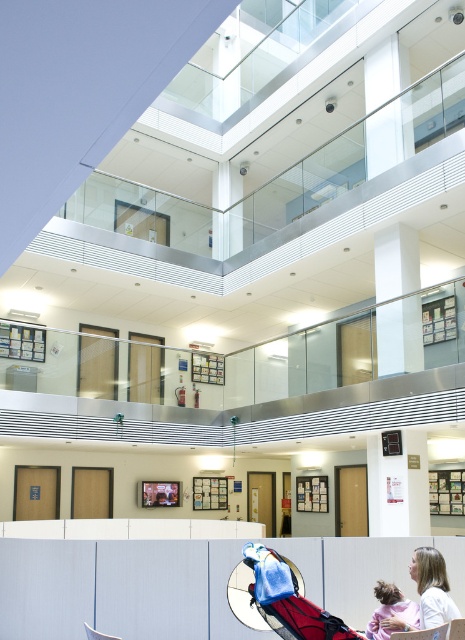
Does red fabric baby carriage at lower center appear on the left side of pink fabric child at lower right?

Indeed, red fabric baby carriage at lower center is positioned on the left side of pink fabric child at lower right.

Can you confirm if red fabric baby carriage at lower center is positioned above pink fabric child at lower right?

Yes, red fabric baby carriage at lower center is above pink fabric child at lower right.

You are a GUI agent. You are given a task and a screenshot of the screen. Output one action in this format:
    pyautogui.click(x=<x>, y=<y>)
    Task: Click on the red fabric baby carriage at lower center
    
    Given the screenshot: What is the action you would take?
    pyautogui.click(x=283, y=600)

Does point (440, 577) lie behind point (385, 586)?

No, it is in front of (385, 586).

Can you confirm if light brown hair at lower right is bigger than pink fabric child at lower right?

Indeed, light brown hair at lower right has a larger size compared to pink fabric child at lower right.

Between point (414, 570) and point (392, 611), which one is positioned behind?

The point (392, 611) is behind.

Find the location of a particular element. This screenshot has height=640, width=465. light brown hair at lower right is located at coordinates (431, 588).

Which is above, red fabric baby carriage at lower center or light brown hair at lower right?

Positioned higher is red fabric baby carriage at lower center.

Can you confirm if red fabric baby carriage at lower center is wider than light brown hair at lower right?

Correct, the width of red fabric baby carriage at lower center exceeds that of light brown hair at lower right.

Image resolution: width=465 pixels, height=640 pixels. What do you see at coordinates (283, 600) in the screenshot?
I see `red fabric baby carriage at lower center` at bounding box center [283, 600].

Identify the location of red fabric baby carriage at lower center. The width and height of the screenshot is (465, 640). (283, 600).